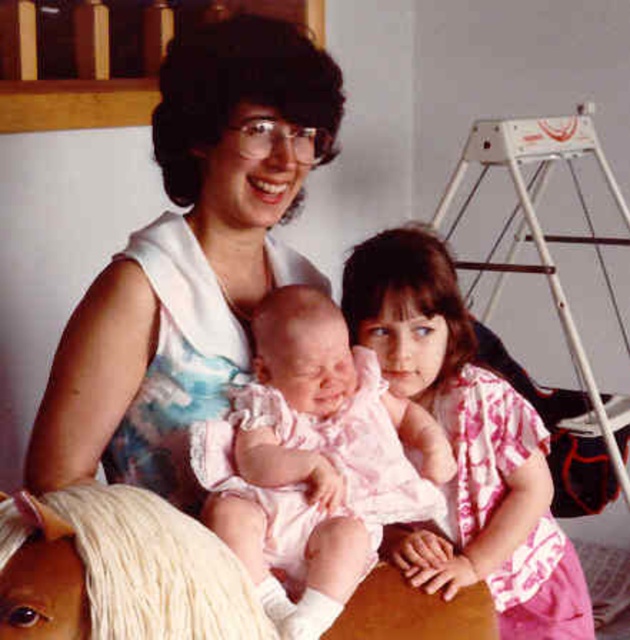
You are a photographer setting up a shoot in this room. You need to place a small tripod between the pink satin dress at center and the white plush horse at lower left. Based on their positions, where should you place the tripod?

The pink satin dress at center is located above the white plush horse at lower left, so you should place the tripod between them in the middle area between the dress and the horse.

You are organizing a small play area and need to place the pink satin dress at center and the white plush horse at lower left. Which object is wider?

The pink satin dress at center is wider than the white plush horse at lower left.

You are a photographer setting up a shoot in this room. You need to position a camera on a tripod so that both the pink floral shirt at center and the white plush horse at lower left are in frame. Considering their height differences, where should you adjust the camera angle to ensure both are visible?

The pink floral shirt at center is much taller than the white plush horse at lower left. To capture both in the frame, position the camera at a lower angle to include the base of the pink floral shirt at center and still see the white plush horse at lower left.